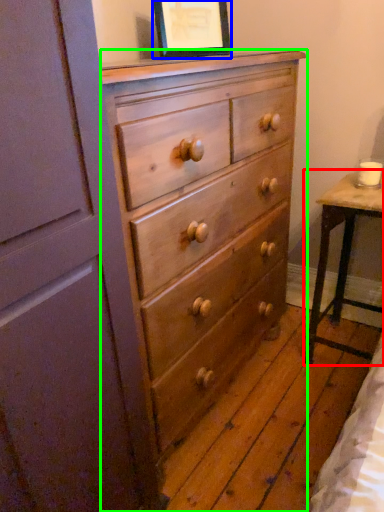
Question: Which object is positioned farthest from table (highlighted by a red box)? Select from picture frame (highlighted by a blue box) and chest of drawers (highlighted by a green box).

Choices:
 (A) picture frame
 (B) chest of drawers

Answer: (A)